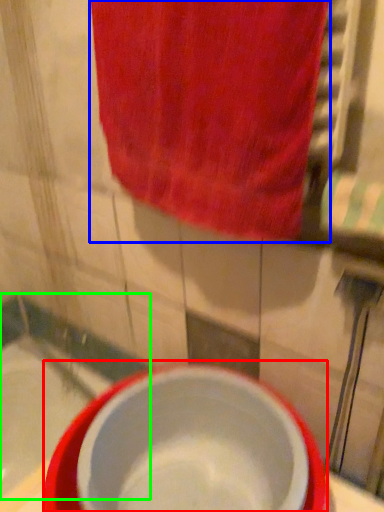
Question: Which object is positioned farthest from basin (highlighted by a red box)? Select from towel (highlighted by a blue box) and bath (highlighted by a green box).

Choices:
 (A) towel
 (B) bath

Answer: (B)